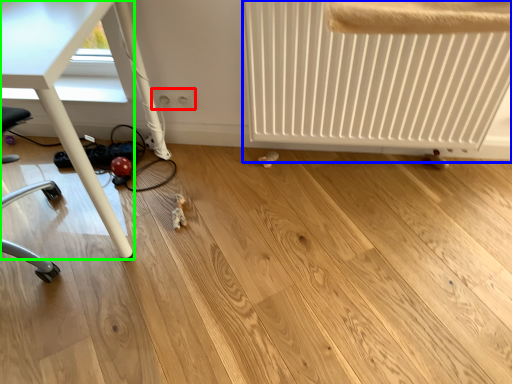
Question: Which is nearer to the electric outlet (highlighted by a red box)? radiator (highlighted by a blue box) or table (highlighted by a green box).

Choices:
 (A) radiator
 (B) table

Answer: (B)